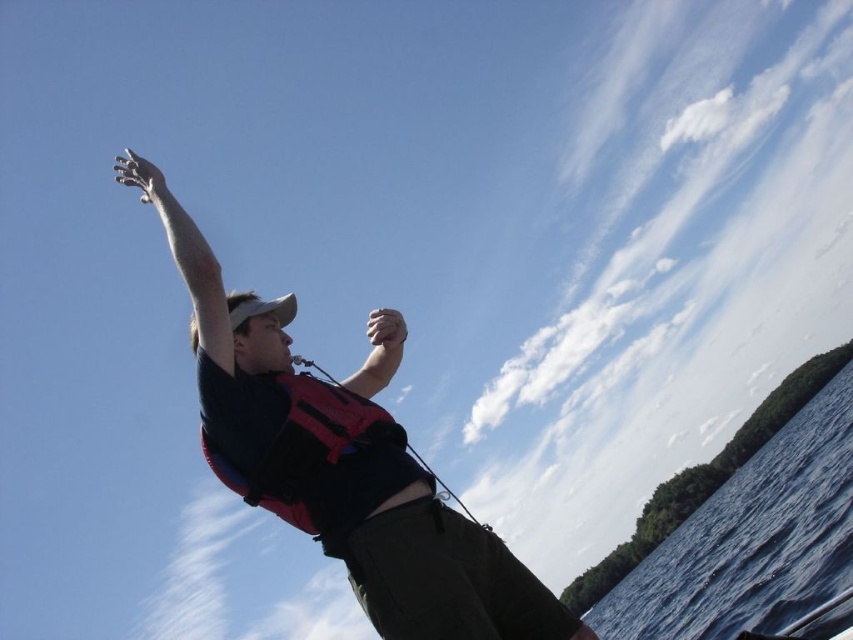
Question: Which point appears farthest from the camera in this image?

Choices:
 (A) (810, 464)
 (B) (302, 508)
 (C) (468, 632)

Answer: (A)

Question: From the image, what is the correct spatial relationship of blue liquid water at lower right in relation to red fabric life jacket at center?

Choices:
 (A) right
 (B) left

Answer: (A)

Question: Which of the following is the farthest from the observer?

Choices:
 (A) blue liquid water at lower right
 (B) red fabric life jacket at center

Answer: (A)

Question: Does blue liquid water at lower right have a larger size compared to red fabric life jacket at center?

Choices:
 (A) no
 (B) yes

Answer: (B)

Question: Among these objects, which one is nearest to the camera?

Choices:
 (A) red life vest at center
 (B) blue liquid water at lower right
 (C) red fabric life jacket at center

Answer: (A)

Question: Is blue liquid water at lower right to the left of red fabric life jacket at center from the viewer's perspective?

Choices:
 (A) yes
 (B) no

Answer: (B)